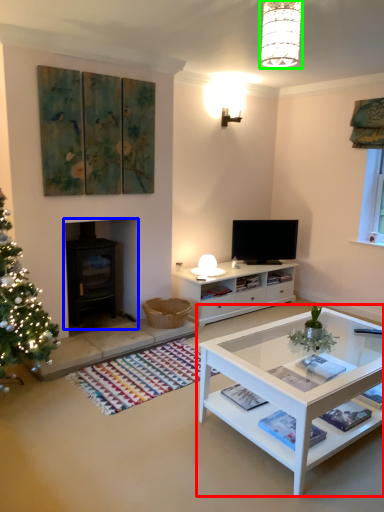
Question: Which object is positioned farthest from coffee table (highlighted by a red box)? Select from fireplace (highlighted by a blue box) and lamp (highlighted by a green box).

Choices:
 (A) fireplace
 (B) lamp

Answer: (B)